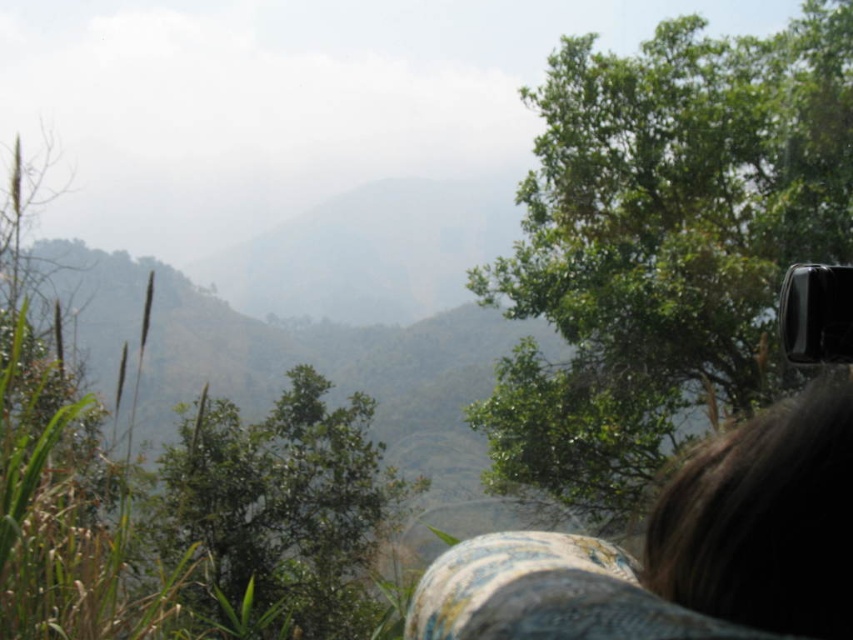
Question: Which of the following is the farthest from the observer?

Choices:
 (A) green leafy tree at upper right
 (B) green leafy tree at center

Answer: (A)

Question: Is green leafy tree at upper right bigger than green leafy tree at center?

Choices:
 (A) no
 (B) yes

Answer: (B)

Question: Is green leafy tree at upper right bigger than green leafy tree at center?

Choices:
 (A) yes
 (B) no

Answer: (A)

Question: Which object is closer to the camera taking this photo?

Choices:
 (A) green leafy tree at center
 (B) green leafy tree at upper right

Answer: (A)

Question: Does green leafy tree at upper right have a greater width compared to green leafy tree at center?

Choices:
 (A) yes
 (B) no

Answer: (A)